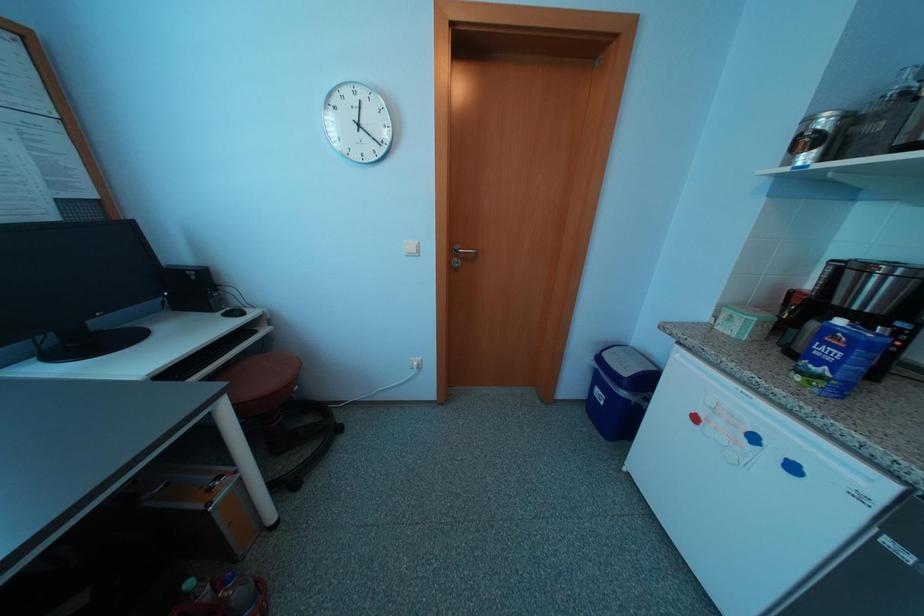
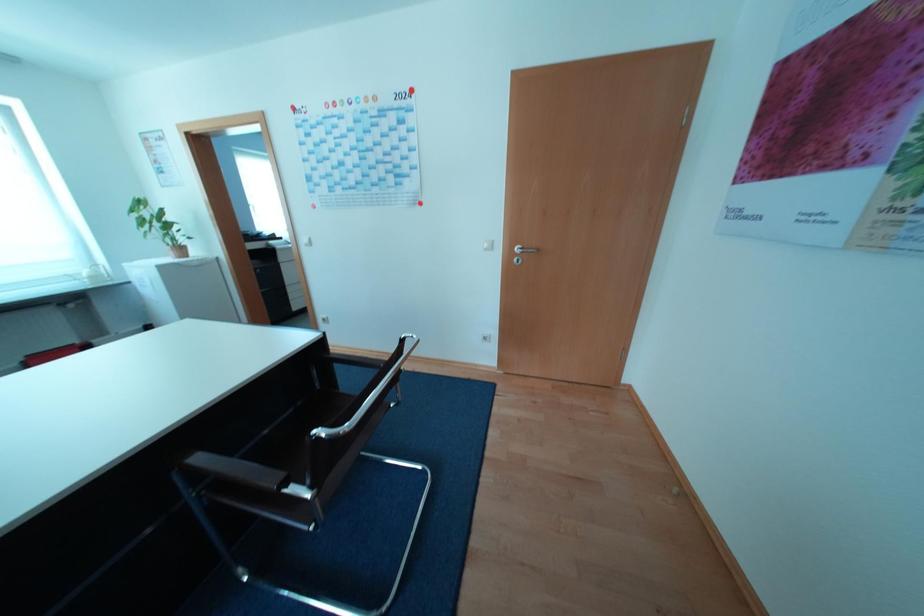
In a continuous first-person perspective shot, in which direction is the camera moving?

The movement direction of the cameraman is right, backward.